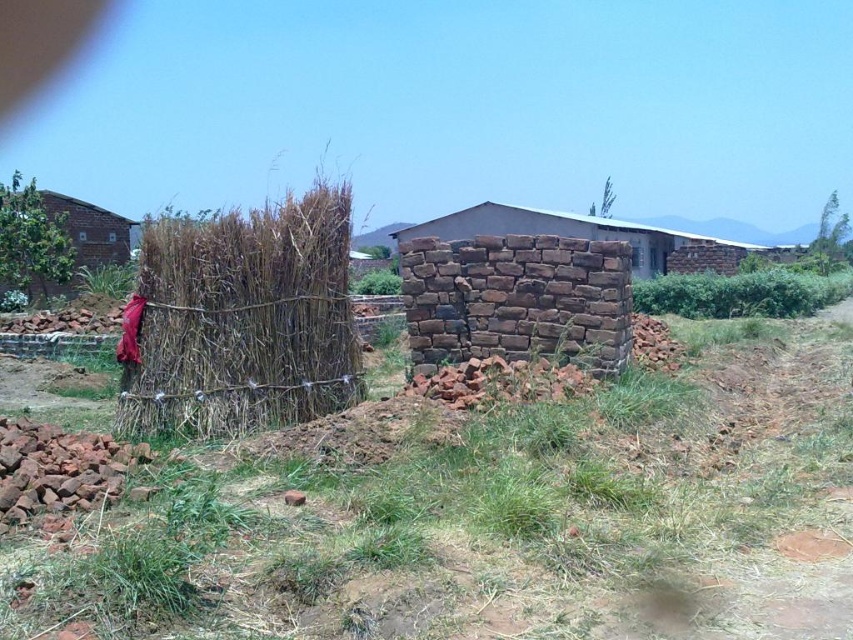
Question: Does dry straw at left lie in front of brown stone wall at center?

Choices:
 (A) yes
 (B) no

Answer: (A)

Question: Observing the image, what is the correct spatial positioning of dry straw at left in reference to brown stone wall at center?

Choices:
 (A) left
 (B) right

Answer: (A)

Question: Is dry straw at left bigger than brown stone wall at center?

Choices:
 (A) yes
 (B) no

Answer: (B)

Question: Which point is closer to the camera taking this photo?

Choices:
 (A) (490, 227)
 (B) (328, 291)
 (C) (71, 232)

Answer: (B)

Question: Among these objects, which one is nearest to the camera?

Choices:
 (A) green grass at center
 (B) brown rough stone wall at center
 (C) brick wall at left
 (D) dry straw at left

Answer: (A)

Question: Among these objects, which one is farthest from the camera?

Choices:
 (A) brown stone wall at center
 (B) dry straw at left
 (C) brown rough stone wall at center
 (D) brick wall at left

Answer: (D)